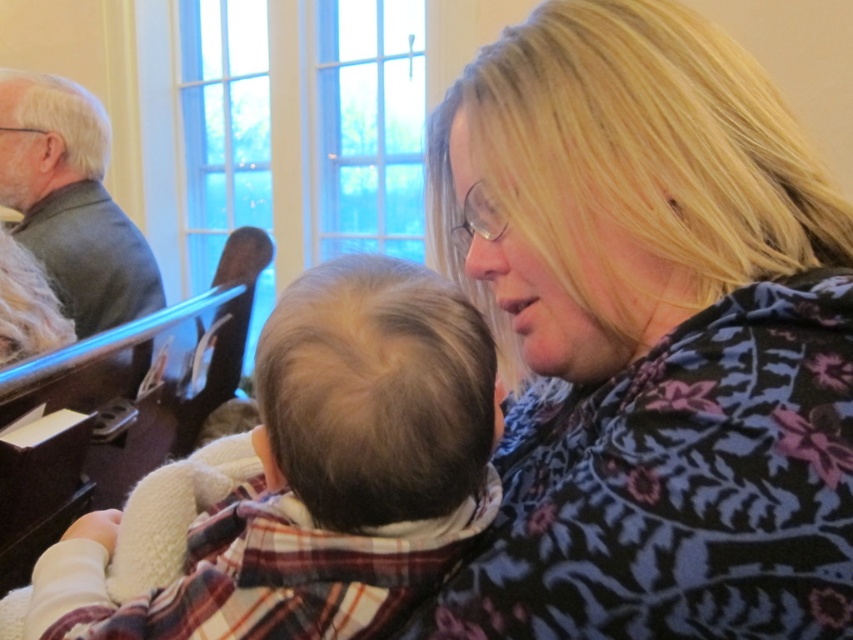
Does floral-patterned sweater at center appear on the right side of fluffy white baby at center?

Yes, floral-patterned sweater at center is to the right of fluffy white baby at center.

Does floral-patterned sweater at center have a smaller size compared to fluffy white baby at center?

No, floral-patterned sweater at center is not smaller than fluffy white baby at center.

Between point (701, 321) and point (218, 604), which one is positioned behind?

The point (701, 321) is behind.

The width and height of the screenshot is (853, 640). I want to click on floral-patterned sweater at center, so click(x=648, y=336).